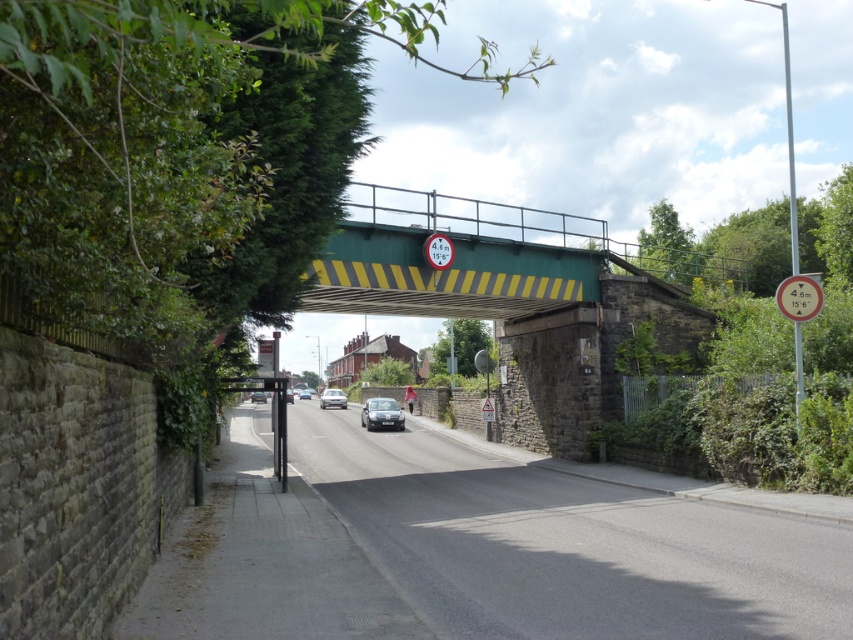
Between point (445, 252) and point (289, 388), which one is positioned in front?

Positioned in front is point (445, 252).

At what (x,y) coordinates should I click in order to perform the action: click on yellow/black striped sign at upper center. Please return your answer as a coordinate pair (x, y). This screenshot has width=853, height=640. Looking at the image, I should click on (438, 250).

The width and height of the screenshot is (853, 640). Describe the element at coordinates (438, 250) in the screenshot. I see `yellow/black striped sign at upper center` at that location.

Where is `yellow/black striped sign at upper center`? This screenshot has height=640, width=853. yellow/black striped sign at upper center is located at coordinates (438, 250).

Can you confirm if silver metallic sedan at center is shorter than matte black car at center?

Yes, silver metallic sedan at center is shorter than matte black car at center.

Is silver metallic sedan at center bigger than matte black car at center?

Actually, silver metallic sedan at center might be smaller than matte black car at center.

Who is more forward, (302, 390) or (292, 401)?

Point (292, 401)

Locate an element on the screen. This screenshot has height=640, width=853. silver metallic sedan at center is located at coordinates (305, 394).

Is metallic circular sign at center to the left of metallic silver car at center from the viewer's perspective?

No, metallic circular sign at center is not to the left of metallic silver car at center.

Image resolution: width=853 pixels, height=640 pixels. What do you see at coordinates (799, 298) in the screenshot?
I see `metallic circular sign at center` at bounding box center [799, 298].

What do you see at coordinates (799, 298) in the screenshot? I see `metallic circular sign at center` at bounding box center [799, 298].

This screenshot has width=853, height=640. I want to click on metallic circular sign at center, so click(x=799, y=298).